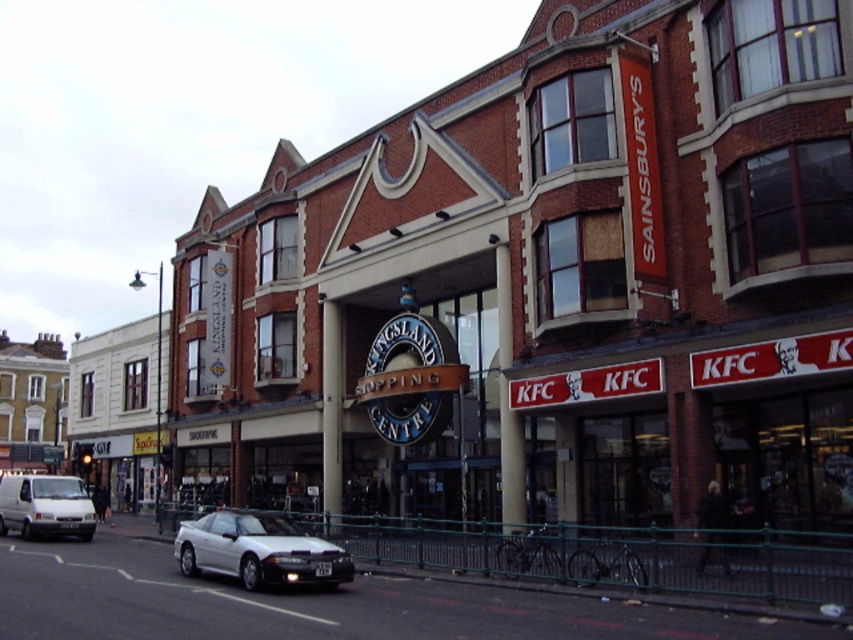
You are standing at the entrance of Kingsland Shopping Centre and want to locate the white glossy car at lower left. According to the coordinates provided, where exactly should you look to find it?

The white glossy car at lower left is located at coordinates point (x=258, y=550).

You are a delivery person who needs to park your white matte van at lower left near the shopping center entrance. There is a white glossy car at lower left already parked there. Can you still park your van in the same spot without moving the car?

The white glossy car at lower left is positioned on the right side of white matte van at lower left, meaning the van is already parked to the left of the car. Since the car is already occupying the right side of the parking spot, there might not be enough space left for the van to park without overlapping. Therefore, it might not be possible to park the white matte van at lower left in the same spot without moving the car.

You are standing in front of the Kingsland Shopping Centre and want to take a photo of the entrance. There are two points marked on your camera screen at coordinates point (344, 577) and point (3, 524). Which point should you focus on to ensure the entrance is in focus?

You should focus on point (344, 577) because it is closer to the viewer than point (3, 524), ensuring the entrance will be in focus.